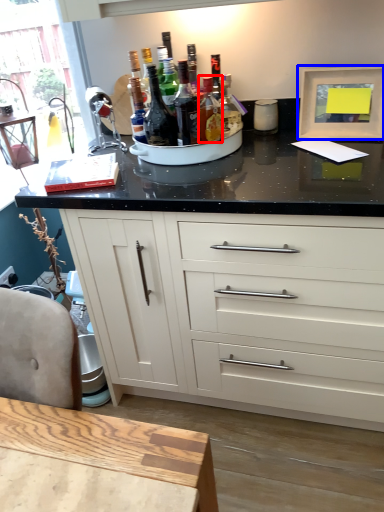
Question: Which of the following is the farthest to the observer, bottle (highlighted by a red box) or picture frame (highlighted by a blue box)?

Choices:
 (A) bottle
 (B) picture frame

Answer: (B)